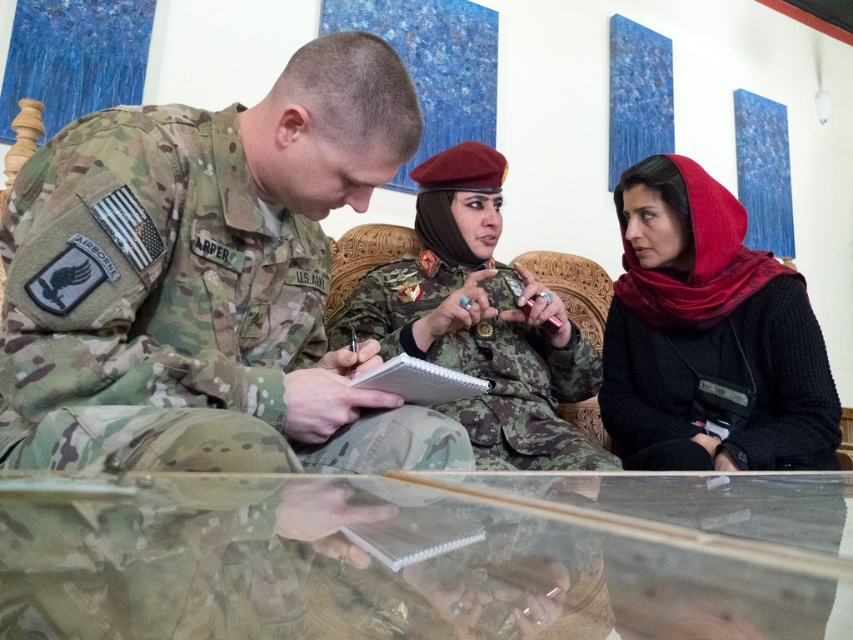
Question: Is camouflage fabric uniform at center wider than white paper clipboard at center?

Choices:
 (A) yes
 (B) no

Answer: (A)

Question: Does transparent glass table at center appear on the left side of camouflage fabric uniform at center?

Choices:
 (A) no
 (B) yes

Answer: (A)

Question: Which object is closer to the camera taking this photo?

Choices:
 (A) camouflage fabric uniform at center
 (B) transparent glass table at center

Answer: (B)

Question: Among these objects, which one is farthest from the camera?

Choices:
 (A) camouflage fabric uniform at center
 (B) white paper clipboard at center

Answer: (A)

Question: Which point is closer to the camera?

Choices:
 (A) camouflage fabric uniform at center
 (B) black knitted scarf at right
 (C) white paper clipboard at center
 (D) transparent glass table at center

Answer: (D)

Question: Is transparent glass table at center smaller than white paper clipboard at center?

Choices:
 (A) no
 (B) yes

Answer: (A)